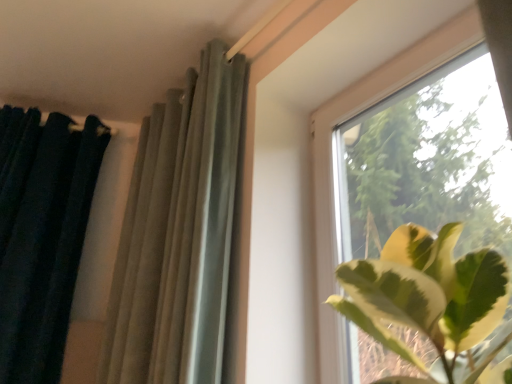
What do you see at coordinates (338, 162) in the screenshot? The width and height of the screenshot is (512, 384). I see `transparent glass window at upper right` at bounding box center [338, 162].

The width and height of the screenshot is (512, 384). I want to click on satin gray curtain at upper center, the 2th curtain when ordered from left to right, so click(179, 233).

Find the location of a particular element. transparent glass window at upper right is located at coordinates (338, 162).

Is satin gray curtain at upper center, which ranks as the first curtain in right-to-left order, placed right next to transparent glass window at upper right?

No, satin gray curtain at upper center, which ranks as the first curtain in right-to-left order, is not with transparent glass window at upper right.

Is satin gray curtain at upper center, which ranks as the first curtain in right-to-left order, inside or outside of transparent glass window at upper right?

The correct answer is: outside.

Between satin gray curtain at upper center, which ranks as the first curtain in right-to-left order, and transparent glass window at upper right, which one is positioned behind?

satin gray curtain at upper center, which ranks as the first curtain in right-to-left order, is behind.

Does satin gray curtain at upper center, the 2th curtain when ordered from left to right, have a larger size compared to transparent glass window at upper right?

Indeed, satin gray curtain at upper center, the 2th curtain when ordered from left to right, has a larger size compared to transparent glass window at upper right.

Is dark green velvet curtain at left, positioned as the 2th curtain in right-to-left order, touching satin gray curtain at upper center, the 2th curtain when ordered from left to right?

No, dark green velvet curtain at left, positioned as the 2th curtain in right-to-left order, is not making contact with satin gray curtain at upper center, the 2th curtain when ordered from left to right.

Is dark green velvet curtain at left, which is counted as the first curtain, starting from the left, turned away from satin gray curtain at upper center, which ranks as the first curtain in right-to-left order?

dark green velvet curtain at left, which is counted as the first curtain, starting from the left, does not have its back to satin gray curtain at upper center, which ranks as the first curtain in right-to-left order.

Is point (54, 365) less distant than point (146, 353)?

No.

Which is more to the left, dark green velvet curtain at left, positioned as the 2th curtain in right-to-left order, or satin gray curtain at upper center, which ranks as the first curtain in right-to-left order?

Positioned to the left is dark green velvet curtain at left, positioned as the 2th curtain in right-to-left order.

From the image's perspective, is transparent glass window at upper right located above or below satin gray curtain at upper center, the 2th curtain when ordered from left to right?

Clearly, from the image's perspective, transparent glass window at upper right is above satin gray curtain at upper center, the 2th curtain when ordered from left to right.

From a real-world perspective, is transparent glass window at upper right on satin gray curtain at upper center, the 2th curtain when ordered from left to right?

No.

Would you say transparent glass window at upper right is to the left or to the right of satin gray curtain at upper center, which ranks as the first curtain in right-to-left order, in the picture?

transparent glass window at upper right is to the right of satin gray curtain at upper center, which ranks as the first curtain in right-to-left order.

Which of these two, dark green velvet curtain at left, positioned as the 2th curtain in right-to-left order, or transparent glass window at upper right, stands shorter?

With less height is transparent glass window at upper right.

In terms of width, does dark green velvet curtain at left, positioned as the 2th curtain in right-to-left order, look wider or thinner when compared to transparent glass window at upper right?

Considering their sizes, dark green velvet curtain at left, positioned as the 2th curtain in right-to-left order, looks broader than transparent glass window at upper right.

From a real-world perspective, who is located lower, dark green velvet curtain at left, which is counted as the first curtain, starting from the left, or transparent glass window at upper right?

From a 3D spatial view, transparent glass window at upper right is below.

From the image's perspective, is transparent glass window at upper right over dark green velvet curtain at left, positioned as the 2th curtain in right-to-left order?

Correct, transparent glass window at upper right appears higher than dark green velvet curtain at left, positioned as the 2th curtain in right-to-left order, in the image.

Which is more to the left, transparent glass window at upper right or dark green velvet curtain at left, which is counted as the first curtain, starting from the left?

dark green velvet curtain at left, which is counted as the first curtain, starting from the left.

Between transparent glass window at upper right and dark green velvet curtain at left, which is counted as the first curtain, starting from the left, which one has smaller width?

Thinner between the two is transparent glass window at upper right.

Could you tell me if transparent glass window at upper right is turned towards dark green velvet curtain at left, positioned as the 2th curtain in right-to-left order?

No, transparent glass window at upper right is not turned towards dark green velvet curtain at left, positioned as the 2th curtain in right-to-left order.

Between satin gray curtain at upper center, the 2th curtain when ordered from left to right, and dark green velvet curtain at left, which is counted as the first curtain, starting from the left, which one has larger width?

Wider between the two is dark green velvet curtain at left, which is counted as the first curtain, starting from the left.

Does satin gray curtain at upper center, the 2th curtain when ordered from left to right, turn towards dark green velvet curtain at left, positioned as the 2th curtain in right-to-left order?

No, satin gray curtain at upper center, the 2th curtain when ordered from left to right, is not facing towards dark green velvet curtain at left, positioned as the 2th curtain in right-to-left order.

From the picture: From the image's perspective, which is above, satin gray curtain at upper center, which ranks as the first curtain in right-to-left order, or dark green velvet curtain at left, which is counted as the first curtain, starting from the left?

From the image's view, satin gray curtain at upper center, which ranks as the first curtain in right-to-left order, is above.

Is dark green velvet curtain at left, which is counted as the first curtain, starting from the left, surrounded by satin gray curtain at upper center, the 2th curtain when ordered from left to right?

No, dark green velvet curtain at left, which is counted as the first curtain, starting from the left, is not a part of satin gray curtain at upper center, the 2th curtain when ordered from left to right.

In the image, there is a satin gray curtain at upper center, the 2th curtain when ordered from left to right. What are the coordinates of `window above it (from the image's perspective)` in the screenshot? It's located at (338, 162).

Where is `curtain that is on the left side of satin gray curtain at upper center, which ranks as the first curtain in right-to-left order`? The image size is (512, 384). curtain that is on the left side of satin gray curtain at upper center, which ranks as the first curtain in right-to-left order is located at coordinates (42, 235).

Looking at the image, which one is located closer to transparent glass window at upper right, satin gray curtain at upper center, which ranks as the first curtain in right-to-left order, or dark green velvet curtain at left, positioned as the 2th curtain in right-to-left order?

satin gray curtain at upper center, which ranks as the first curtain in right-to-left order, is closer to transparent glass window at upper right.

Based on their spatial positions, is satin gray curtain at upper center, the 2th curtain when ordered from left to right, or transparent glass window at upper right further from dark green velvet curtain at left, which is counted as the first curtain, starting from the left?

transparent glass window at upper right lies further to dark green velvet curtain at left, which is counted as the first curtain, starting from the left, than the other object.

Which object lies nearer to the anchor point satin gray curtain at upper center, which ranks as the first curtain in right-to-left order, transparent glass window at upper right or dark green velvet curtain at left, positioned as the 2th curtain in right-to-left order?

transparent glass window at upper right is closer to satin gray curtain at upper center, which ranks as the first curtain in right-to-left order.

Estimate the real-world distances between objects in this image. Which object is further from dark green velvet curtain at left, which is counted as the first curtain, starting from the left, transparent glass window at upper right or satin gray curtain at upper center, which ranks as the first curtain in right-to-left order?

transparent glass window at upper right is positioned further to the anchor dark green velvet curtain at left, which is counted as the first curtain, starting from the left.

Which object lies nearer to the anchor point satin gray curtain at upper center, the 2th curtain when ordered from left to right, dark green velvet curtain at left, positioned as the 2th curtain in right-to-left order, or transparent glass window at upper right?

transparent glass window at upper right lies closer to satin gray curtain at upper center, the 2th curtain when ordered from left to right, than the other object.

Considering their positions, is dark green velvet curtain at left, which is counted as the first curtain, starting from the left, positioned further to transparent glass window at upper right than satin gray curtain at upper center, the 2th curtain when ordered from left to right?

dark green velvet curtain at left, which is counted as the first curtain, starting from the left, is positioned further to the anchor transparent glass window at upper right.

Where is `curtain between dark green velvet curtain at left, which is counted as the first curtain, starting from the left, and transparent glass window at upper right from left to right`? This screenshot has height=384, width=512. curtain between dark green velvet curtain at left, which is counted as the first curtain, starting from the left, and transparent glass window at upper right from left to right is located at coordinates (179, 233).